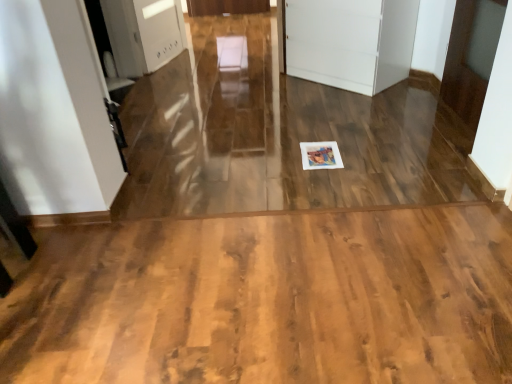
Identify the location of white glossy door at upper right, which is counted as the 1th door, starting from the right. (469, 67).

What do you see at coordinates (350, 42) in the screenshot? I see `white matte cabinet at center, which is the 2th door from right to left` at bounding box center [350, 42].

The height and width of the screenshot is (384, 512). I want to click on wooden floor at center, so click(x=269, y=300).

Is wooden floor at center facing away from white glossy door at upper right, which ranks as the 2th door in left-to-right order?

wooden floor at center is not turned away from white glossy door at upper right, which ranks as the 2th door in left-to-right order.

Who is shorter, wooden floor at center or white glossy door at upper right, which ranks as the 2th door in left-to-right order?

With less height is wooden floor at center.

Do you think wooden floor at center is within white glossy door at upper right, which is counted as the 1th door, starting from the right, or outside of it?

wooden floor at center is outside white glossy door at upper right, which is counted as the 1th door, starting from the right.

How many degrees apart are the facing directions of wooden floor at center and white glossy door at upper right, which is counted as the 1th door, starting from the right?

89.2 degrees.

How far apart are white glossy door at upper right, which is counted as the 1th door, starting from the right, and white matte cabinet at center, acting as the first door starting from the left?

white glossy door at upper right, which is counted as the 1th door, starting from the right, is 25.10 inches away from white matte cabinet at center, acting as the first door starting from the left.

Between point (480, 83) and point (416, 11), which one is positioned behind?

Point (416, 11)

Is white glossy door at upper right, which is counted as the 1th door, starting from the right, oriented away from white matte cabinet at center, which is the 2th door from right to left?

white glossy door at upper right, which is counted as the 1th door, starting from the right, does not have its back to white matte cabinet at center, which is the 2th door from right to left.

How many degrees apart are the facing directions of white glossy door at upper right, which is counted as the 1th door, starting from the right, and white matte cabinet at center, which is the 2th door from right to left?

white glossy door at upper right, which is counted as the 1th door, starting from the right, and white matte cabinet at center, which is the 2th door from right to left, are facing 44.5 degrees away from each other.

Could you tell me if white glossy door at upper right, which ranks as the 2th door in left-to-right order, is facing wooden floor at center?

No, white glossy door at upper right, which ranks as the 2th door in left-to-right order, is not turned towards wooden floor at center.

Between point (486, 32) and point (498, 222), which one is positioned behind?

Positioned behind is point (486, 32).

Considering the relative sizes of white glossy door at upper right, which ranks as the 2th door in left-to-right order, and wooden floor at center in the image provided, is white glossy door at upper right, which ranks as the 2th door in left-to-right order, wider than wooden floor at center?

No, white glossy door at upper right, which ranks as the 2th door in left-to-right order, is not wider than wooden floor at center.

How different are the orientations of white glossy door at upper right, which ranks as the 2th door in left-to-right order, and wooden floor at center in degrees?

89.2 degrees separate the facing orientations of white glossy door at upper right, which ranks as the 2th door in left-to-right order, and wooden floor at center.

Does white matte cabinet at center, acting as the first door starting from the left, have a smaller size compared to white glossy door at upper right, which is counted as the 1th door, starting from the right?

Actually, white matte cabinet at center, acting as the first door starting from the left, might be larger than white glossy door at upper right, which is counted as the 1th door, starting from the right.

Is white matte cabinet at center, acting as the first door starting from the left, wider or thinner than white glossy door at upper right, which is counted as the 1th door, starting from the right?

white matte cabinet at center, acting as the first door starting from the left, is wider than white glossy door at upper right, which is counted as the 1th door, starting from the right.

From the image's perspective, who appears lower, white matte cabinet at center, acting as the first door starting from the left, or white glossy door at upper right, which ranks as the 2th door in left-to-right order?

white glossy door at upper right, which ranks as the 2th door in left-to-right order, from the image's perspective.

Is white matte cabinet at center, which is the 2th door from right to left, situated inside wooden floor at center or outside?

white matte cabinet at center, which is the 2th door from right to left, is outside wooden floor at center.

Are white matte cabinet at center, which is the 2th door from right to left, and wooden floor at center far apart?

Absolutely, white matte cabinet at center, which is the 2th door from right to left, is distant from wooden floor at center.

Considering the relative sizes of white matte cabinet at center, which is the 2th door from right to left, and wooden floor at center in the image provided, is white matte cabinet at center, which is the 2th door from right to left, bigger than wooden floor at center?

Yes.

From the image's perspective, between wooden floor at center and white matte cabinet at center, which is the 2th door from right to left, which one is located above?

white matte cabinet at center, which is the 2th door from right to left, from the image's perspective.

Does point (313, 361) lie behind point (379, 5)?

No, (313, 361) is closer to viewer.

Between wooden floor at center and white matte cabinet at center, acting as the first door starting from the left, which one is positioned behind?

white matte cabinet at center, acting as the first door starting from the left, is further from the camera.

Identify the location of corridor below the white glossy door at upper right, which ranks as the 2th door in left-to-right order (from the image's perspective). (269, 300).

You are a GUI agent. You are given a task and a screenshot of the screen. Output one action in this format:
    pyautogui.click(x=<x>, y=<y>)
    Task: Click on the door above the white glossy door at upper right, which is counted as the 1th door, starting from the right (from the image's perspective)
    Image resolution: width=512 pixels, height=384 pixels.
    Given the screenshot: What is the action you would take?
    pyautogui.click(x=350, y=42)

Looking at the image, which one is located closer to white matte cabinet at center, which is the 2th door from right to left, wooden floor at center or white glossy door at upper right, which is counted as the 1th door, starting from the right?

white glossy door at upper right, which is counted as the 1th door, starting from the right.

Looking at the image, which one is located further to white glossy door at upper right, which is counted as the 1th door, starting from the right, wooden floor at center or white matte cabinet at center, which is the 2th door from right to left?

Based on the image, wooden floor at center appears to be further to white glossy door at upper right, which is counted as the 1th door, starting from the right.

From the image, which object appears to be farther from white glossy door at upper right, which ranks as the 2th door in left-to-right order, white matte cabinet at center, acting as the first door starting from the left, or wooden floor at center?

Among the two, wooden floor at center is located further to white glossy door at upper right, which ranks as the 2th door in left-to-right order.

Which object lies further to the anchor point white matte cabinet at center, acting as the first door starting from the left, white glossy door at upper right, which is counted as the 1th door, starting from the right, or wooden floor at center?

wooden floor at center.

Estimate the real-world distances between objects in this image. Which object is closer to wooden floor at center, white glossy door at upper right, which ranks as the 2th door in left-to-right order, or white matte cabinet at center, which is the 2th door from right to left?

The object closer to wooden floor at center is white glossy door at upper right, which ranks as the 2th door in left-to-right order.

From the image, which object appears to be nearer to wooden floor at center, white matte cabinet at center, which is the 2th door from right to left, or white glossy door at upper right, which is counted as the 1th door, starting from the right?

Among the two, white glossy door at upper right, which is counted as the 1th door, starting from the right, is located nearer to wooden floor at center.

Locate an element on the screen. This screenshot has height=384, width=512. door between white matte cabinet at center, acting as the first door starting from the left, and wooden floor at center from top to bottom is located at coordinates (469, 67).